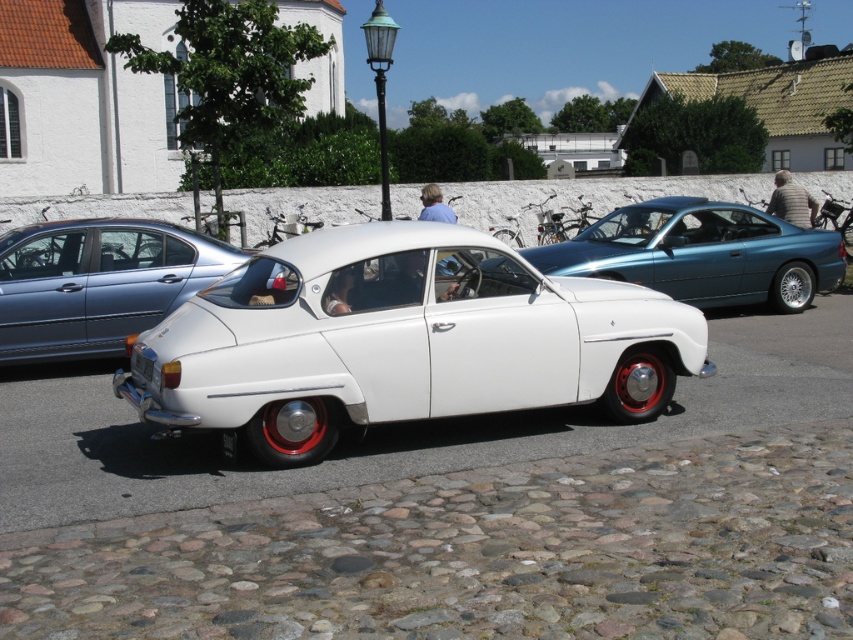
Question: Which object appears closest to the camera in this image?

Choices:
 (A) white plastic license plate at center
 (B) white matte car at center
 (C) metallic blue car at center

Answer: (A)

Question: From the image, what is the correct spatial relationship of metallic blue car at center in relation to white plastic license plate at center?

Choices:
 (A) below
 (B) above

Answer: (B)

Question: Does white matte car at center appear over black plastic license plate at rear?

Choices:
 (A) yes
 (B) no

Answer: (A)

Question: Which point is closer to the camera?

Choices:
 (A) metallic blue car at center
 (B) white plastic license plate at center
 (C) white glossy car at center

Answer: (C)

Question: Which is farther from the metallic blue car at center?

Choices:
 (A) black plastic license plate at rear
 (B) white matte car at center
 (C) white plastic license plate at center

Answer: (C)

Question: Is white glossy car at center further to the viewer compared to white plastic license plate at center?

Choices:
 (A) no
 (B) yes

Answer: (A)